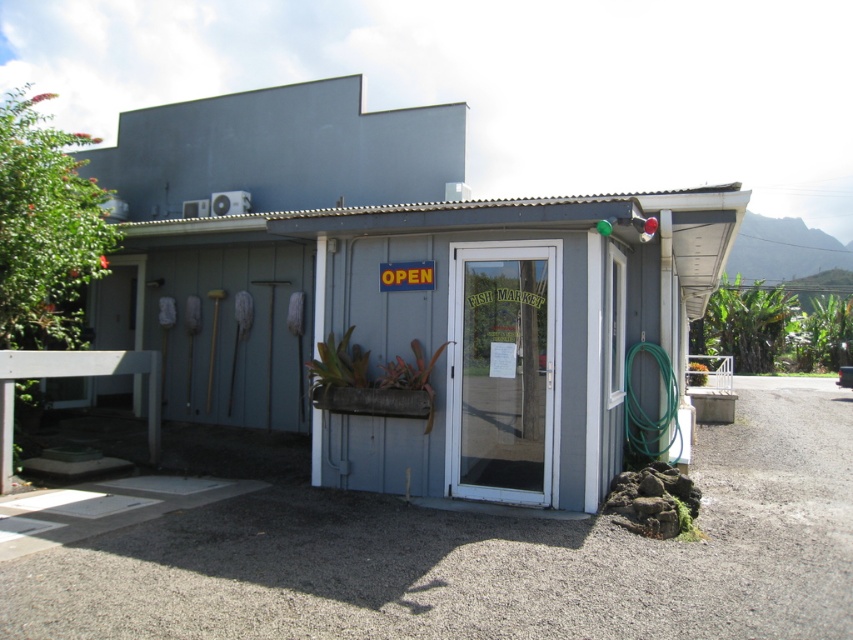
Based on the photo, between matte gray hut at center and transparent glass door at center, which one has more height?

matte gray hut at center is taller.

Is point (142, 330) positioned behind point (503, 440)?

Yes, point (142, 330) is farther from viewer.

At what (x,y) coordinates should I click in order to perform the action: click on matte gray hut at center. Please return your answer as a coordinate pair (x, y). The image size is (853, 640). Looking at the image, I should click on (393, 288).

Is matte gray hut at center wider than green rubber hose at right?

Yes.

Can you confirm if matte gray hut at center is bigger than green rubber hose at right?

Correct, matte gray hut at center is larger in size than green rubber hose at right.

Is point (520, 200) closer to camera compared to point (666, 358)?

Yes, it is.

The image size is (853, 640). I want to click on matte gray hut at center, so click(x=393, y=288).

Is point (479, 410) farther from viewer compared to point (639, 422)?

No, (479, 410) is closer to viewer.

Between transparent glass door at center and green rubber hose at right, which one appears on the right side from the viewer's perspective?

From the viewer's perspective, green rubber hose at right appears more on the right side.

Who is more forward, [534,310] or [650,435]?

Positioned in front is point [534,310].

The height and width of the screenshot is (640, 853). What are the coordinates of `transparent glass door at center` in the screenshot? It's located at (502, 371).